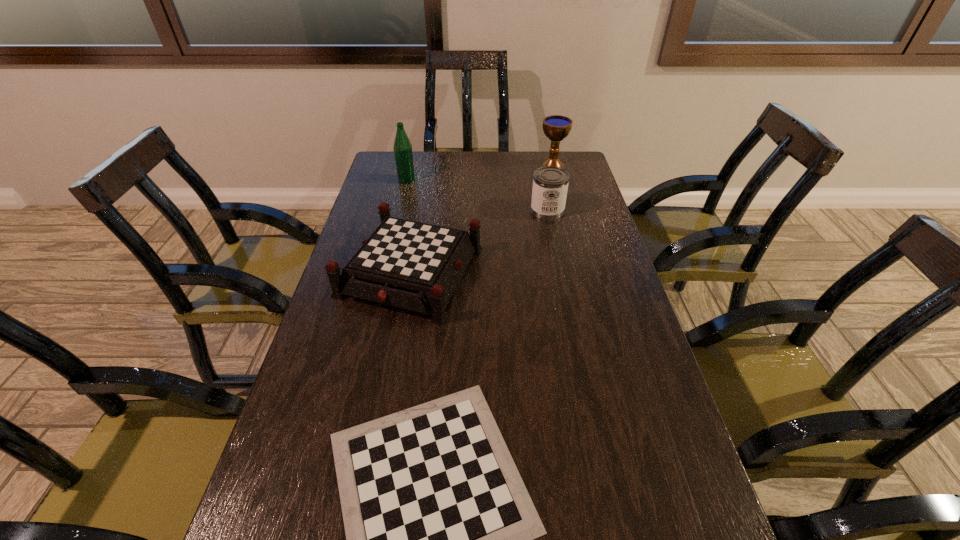
At what (x,y) coordinates should I click in order to perform the action: click on free space located 0.230m on the right of the second shortest object. Please return your answer as a coordinate pair (x, y). Looking at the image, I should click on (563, 272).

Identify the location of bottle present at the far edge. The image size is (960, 540). (402, 147).

Identify the location of chalice present at the far edge. (556, 127).

Image resolution: width=960 pixels, height=540 pixels. Find the location of `bottle that is at the left edge`. bottle that is at the left edge is located at coordinates pyautogui.click(x=402, y=147).

This screenshot has height=540, width=960. I want to click on checkerboard that is at the left edge, so click(x=412, y=265).

Where is `chalice situated at the right edge`? Image resolution: width=960 pixels, height=540 pixels. chalice situated at the right edge is located at coordinates (556, 127).

Locate an element on the screen. can situated at the right edge is located at coordinates (550, 184).

Where is `object at the far left corner`? object at the far left corner is located at coordinates (402, 147).

Find the location of a particular element. The image size is (960, 540). object located in the far right corner section of the desktop is located at coordinates (556, 127).

The height and width of the screenshot is (540, 960). Find the location of `vacant space at the far edge of the desktop`. vacant space at the far edge of the desktop is located at coordinates (510, 159).